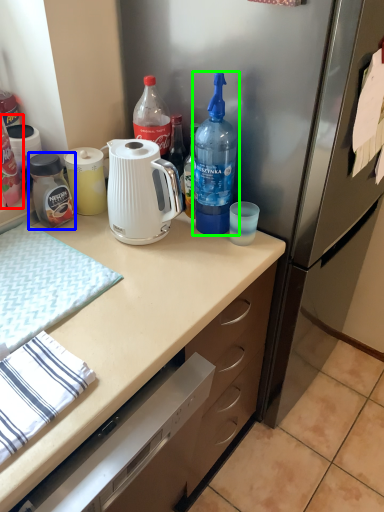
Question: Based on their relative distances, which object is nearer to bottle (highlighted by a red box)? Choose from bottle (highlighted by a blue box) and bottle (highlighted by a green box).

Choices:
 (A) bottle
 (B) bottle

Answer: (A)